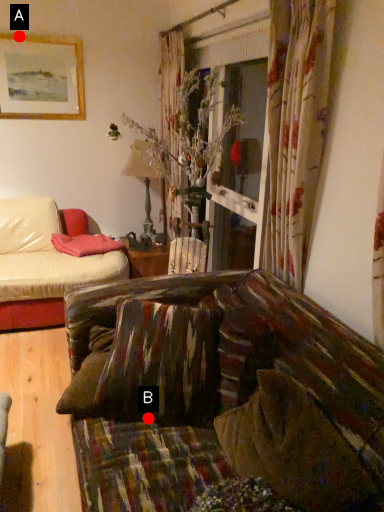
Question: Two points are circled on the image, labeled by A and B beside each circle. Which point is closer to the camera taking this photo?

Choices:
 (A) A is closer
 (B) B is closer

Answer: (B)